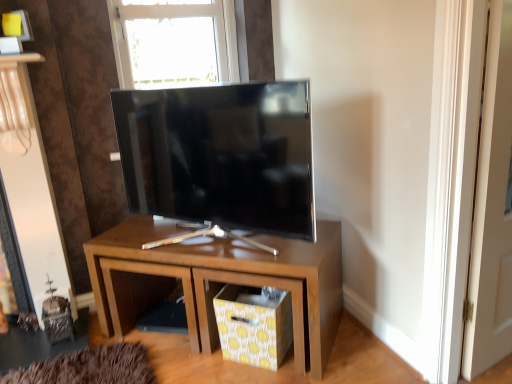
Question: Visually, is yellow dotted fabric drawer at lower center positioned to the left or to the right of matte black tv at center?

Choices:
 (A) right
 (B) left

Answer: (A)

Question: Is yellow dotted fabric drawer at lower center taller or shorter than matte black tv at center?

Choices:
 (A) short
 (B) tall

Answer: (A)

Question: Which object is the closest to the yellow dotted fabric drawer at lower center?

Choices:
 (A) matte wood nightstand at center
 (B) matte black tv at center
 (C) transparent glass window at upper center

Answer: (A)

Question: Estimate the real-world distances between objects in this image. Which object is closer to the yellow dotted fabric drawer at lower center?

Choices:
 (A) transparent glass window at upper center
 (B) matte black tv at center
 (C) matte wood nightstand at center

Answer: (C)